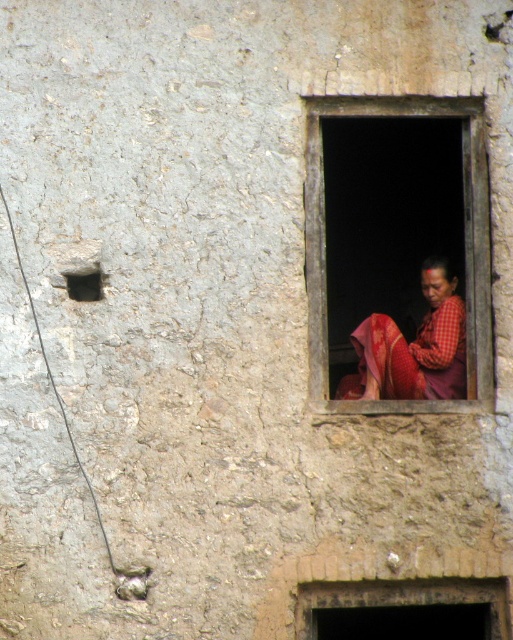
Consider the image. You are an interior designer planning to place a decorative item on the matte red fabric at center and the dark gray concrete hole at upper left. Which surface can accommodate a wider object?

The matte red fabric at center can accommodate a wider object since its width surpasses that of the dark gray concrete hole at upper left.

You are standing in front of the weathered stone wall and notice two points marked on it. Which of the two points, point (353,113) or point (458,305), is closer to you?

Point (353,113) is closer to the viewer than point (458,305).